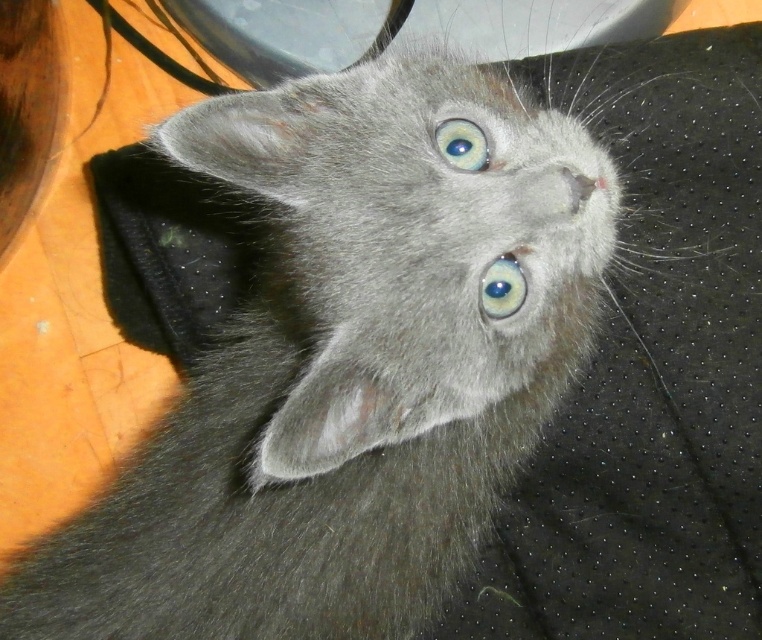
From the picture: You are a photographer trying to capture a closeup of the gray cat. You notice two blue glossy eyes in the image. How far apart are the blue glossy eye at center and the blue glossy eye at upper center?

The blue glossy eye at center is 5.66 inches from the blue glossy eye at upper center.

You are a photographer standing 1 meter away from a wooden table. You see the blue glossy eye at center. Can you safely take a photo without getting too close to the gray cat?

The blue glossy eye at center is 1.05 meters away from the viewer. Since you are standing 1 meter away from the wooden table, you are close enough to take a photo without disturbing the gray cat.